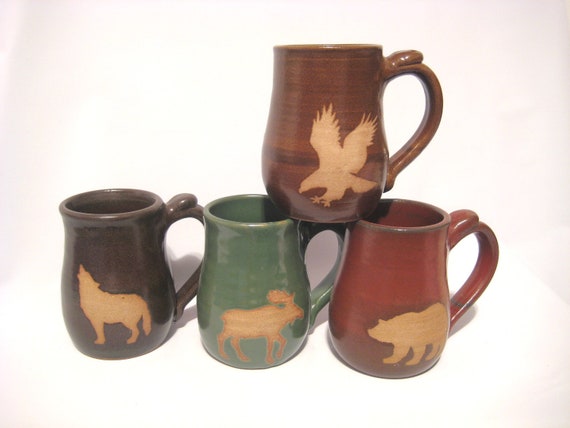
The image size is (570, 428). In order to click on red mug in this screenshot , I will do `click(393, 268)`.